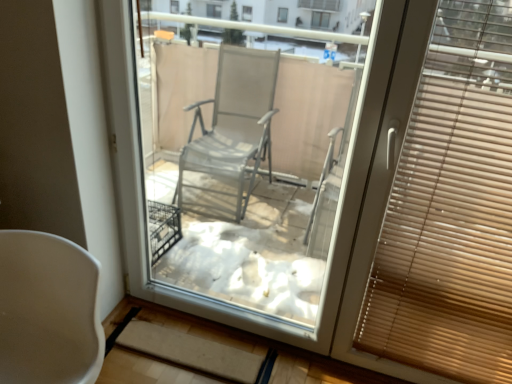
Question: Considering the positions of point (456, 203) and point (42, 279), is point (456, 203) closer or farther from the camera than point (42, 279)?

Choices:
 (A) closer
 (B) farther

Answer: (B)

Question: Looking at their shapes, would you say wooden blinds at right is wider or thinner than white matte chair at lower left?

Choices:
 (A) wide
 (B) thin

Answer: (B)

Question: Would you say wooden blinds at right is to the left or to the right of white matte chair at lower left in the picture?

Choices:
 (A) left
 (B) right

Answer: (B)

Question: In terms of size, does white matte chair at lower left appear bigger or smaller than wooden blinds at right?

Choices:
 (A) big
 (B) small

Answer: (A)

Question: Considering the positions of point (30, 329) and point (435, 152), is point (30, 329) closer or farther from the camera than point (435, 152)?

Choices:
 (A) farther
 (B) closer

Answer: (A)

Question: Is white matte chair at lower left taller or shorter than wooden blinds at right?

Choices:
 (A) short
 (B) tall

Answer: (A)

Question: In terms of width, does white matte chair at lower left look wider or thinner when compared to wooden blinds at right?

Choices:
 (A) thin
 (B) wide

Answer: (B)